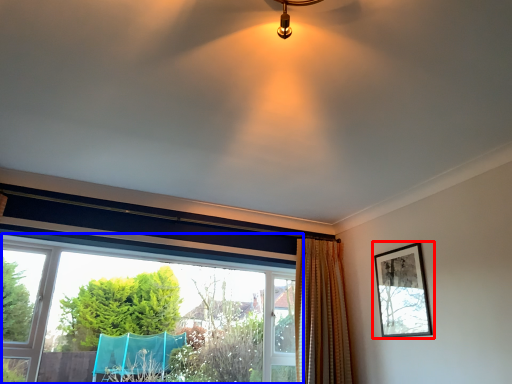
Question: Which object appears farthest to the camera in this image, picture frame (highlighted by a red box) or window (highlighted by a blue box)?

Choices:
 (A) picture frame
 (B) window

Answer: (A)